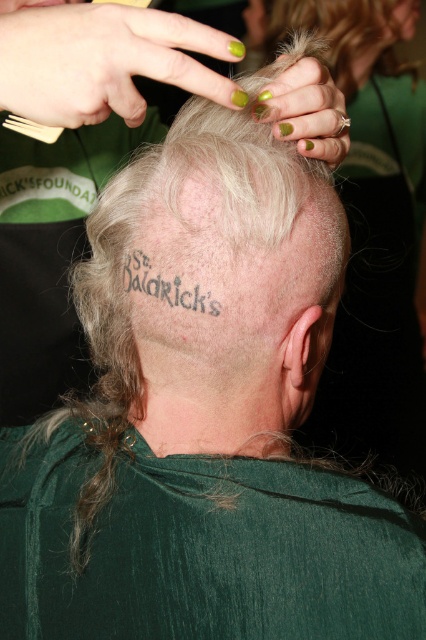
Question: Does gray tattooed skin at center come in front of black tattoo at center back?

Choices:
 (A) no
 (B) yes

Answer: (B)

Question: Which of the following is the farthest from the observer?

Choices:
 (A) (294, 212)
 (B) (187, 285)

Answer: (A)

Question: Is gray tattooed skin at center smaller than black tattoo at center back?

Choices:
 (A) no
 (B) yes

Answer: (A)

Question: Is gray tattooed skin at center positioned before black tattoo at center back?

Choices:
 (A) yes
 (B) no

Answer: (A)